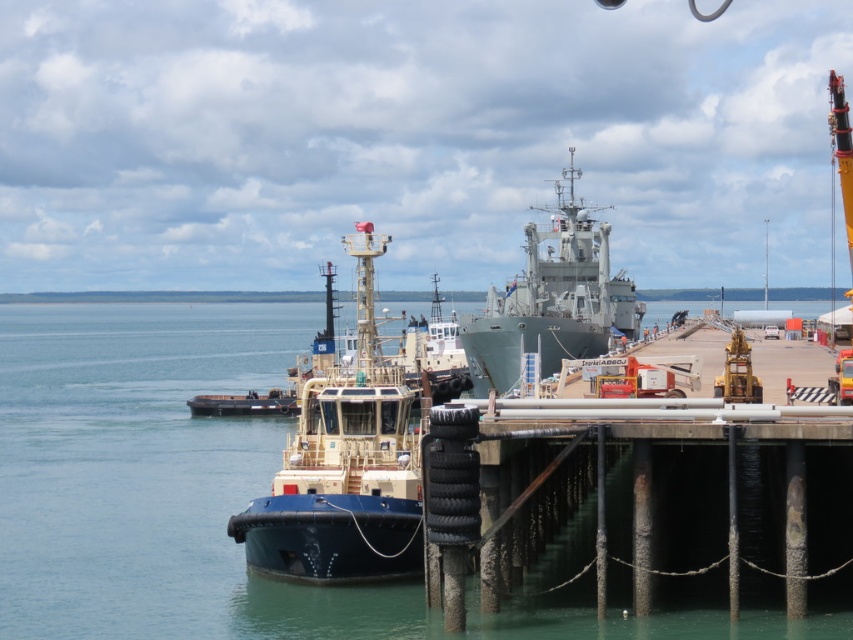
Who is positioned more to the right, blue water at center or blue matte tugboat at center?

blue matte tugboat at center

Which is behind, point (55, 388) or point (283, 556)?

Point (55, 388)

Describe the element at coordinates (149, 477) in the screenshot. I see `blue water at center` at that location.

Identify the location of blue water at center. (149, 477).

Between blue matte tugboat at center and gray metallic ship at center, which one is positioned lower?

blue matte tugboat at center

Can you confirm if blue matte tugboat at center is positioned to the left of gray metallic ship at center?

Correct, you'll find blue matte tugboat at center to the left of gray metallic ship at center.

Is point (402, 378) farther from viewer compared to point (479, 353)?

No, (402, 378) is closer to viewer.

You are a GUI agent. You are given a task and a screenshot of the screen. Output one action in this format:
    pyautogui.click(x=<x>, y=<y>)
    Task: Click on the blue matte tugboat at center
    
    Given the screenshot: What is the action you would take?
    pyautogui.click(x=344, y=465)

In the scene shown: Who is taller, blue water at center or gray metallic ship at center?

With more height is gray metallic ship at center.

Can you confirm if blue water at center is taller than gray metallic ship at center?

No.

Locate an element on the screen. blue water at center is located at coordinates (149, 477).

The width and height of the screenshot is (853, 640). What are the coordinates of `blue water at center` in the screenshot? It's located at (149, 477).